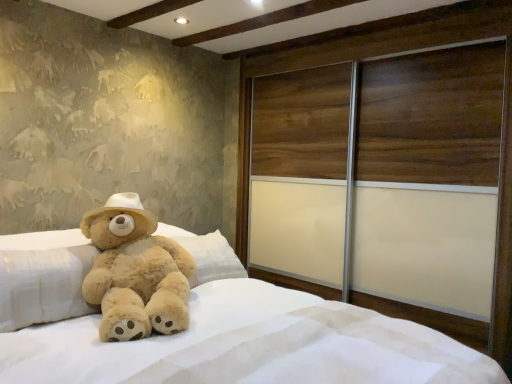
Question: Does fuzzy beige teddy bear at left have a lesser height compared to soft plush bear at center?

Choices:
 (A) no
 (B) yes

Answer: (B)

Question: Does fuzzy beige teddy bear at left have a larger size compared to soft plush bear at center?

Choices:
 (A) no
 (B) yes

Answer: (A)

Question: Could soft plush bear at center be considered to be inside fuzzy beige teddy bear at left?

Choices:
 (A) yes
 (B) no

Answer: (B)

Question: Is fuzzy beige teddy bear at left not close to soft plush bear at center?

Choices:
 (A) no
 (B) yes

Answer: (A)

Question: Is fuzzy beige teddy bear at left to the right of soft plush bear at center from the viewer's perspective?

Choices:
 (A) no
 (B) yes

Answer: (A)

Question: Can you confirm if fuzzy beige teddy bear at left is smaller than soft plush bear at center?

Choices:
 (A) no
 (B) yes

Answer: (B)

Question: From the image's perspective, would you say soft plush bear at center is positioned over wooden sliding door at right?

Choices:
 (A) yes
 (B) no

Answer: (B)

Question: Does soft plush bear at center touch wooden sliding door at right?

Choices:
 (A) yes
 (B) no

Answer: (B)

Question: Is the depth of soft plush bear at center greater than that of wooden sliding door at right?

Choices:
 (A) yes
 (B) no

Answer: (B)

Question: Considering the relative positions of soft plush bear at center and wooden sliding door at right in the image provided, is soft plush bear at center to the right of wooden sliding door at right from the viewer's perspective?

Choices:
 (A) no
 (B) yes

Answer: (A)

Question: Would you say soft plush bear at center is a long distance from wooden sliding door at right?

Choices:
 (A) no
 (B) yes

Answer: (A)

Question: Is soft plush bear at center oriented away from wooden sliding door at right?

Choices:
 (A) yes
 (B) no

Answer: (B)

Question: Is fuzzy beige teddy bear at left further to the viewer compared to wooden sliding door at right?

Choices:
 (A) yes
 (B) no

Answer: (B)